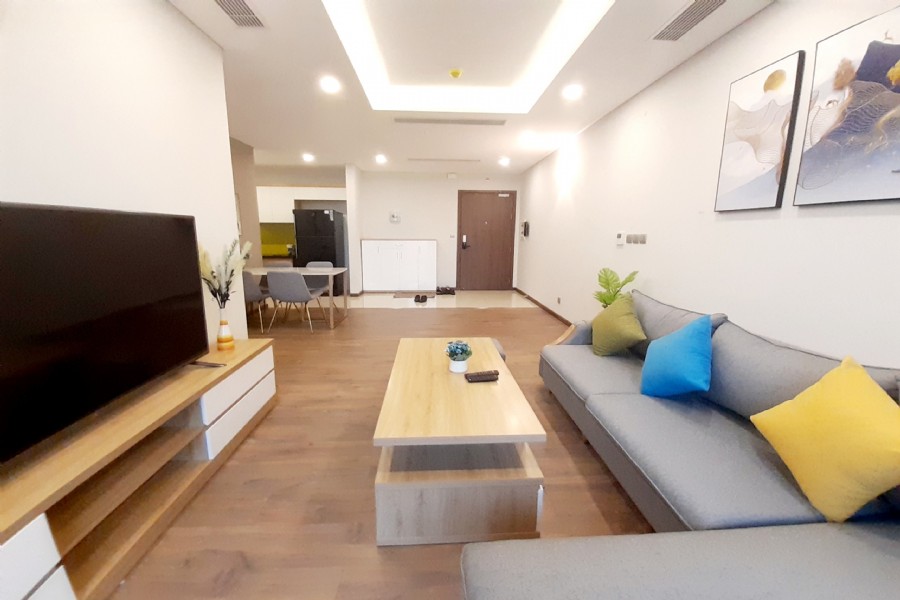
This screenshot has height=600, width=900. What are the coordinates of `door` in the screenshot? It's located at (488, 237).